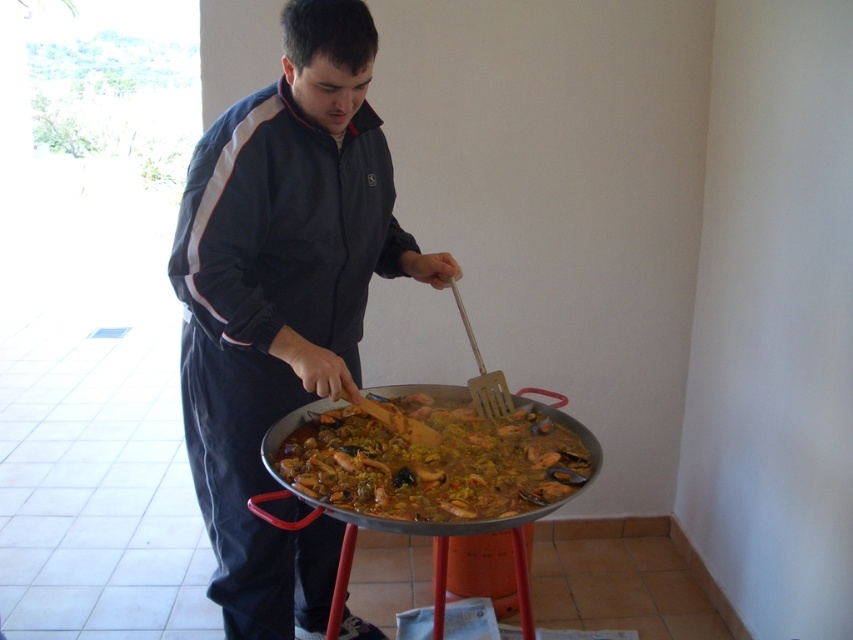
You are a chef observing a cook preparing paella. You notice the dark blue track suit at center and the yellow rice at center. Which item is bigger in size?

The dark blue track suit at center is larger in size compared to the yellow rice at center.

You are standing in the kitchen and see a point at coordinates (x=282, y=298). What object is located at that point?

The point at coordinates (x=282, y=298) marks the dark blue track suit at center.

You are a chef observing someone cooking paella. You notice the dark blue track suit at center and the yellow rice at center. Which one is taller?

The dark blue track suit at center is taller than the yellow rice at center.